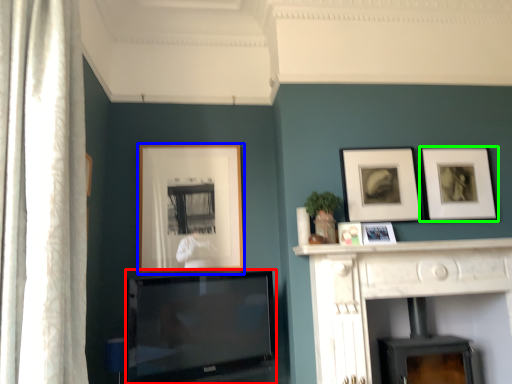
Question: Which is nearer to the television (highlighted by a red box)? picture frame (highlighted by a blue box) or picture frame (highlighted by a green box).

Choices:
 (A) picture frame
 (B) picture frame

Answer: (A)